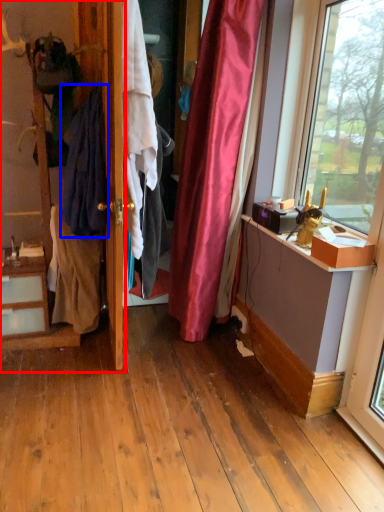
Question: Which object appears farthest to the camera in this image, dresser (highlighted by a red box) or clothing (highlighted by a blue box)?

Choices:
 (A) dresser
 (B) clothing

Answer: (B)